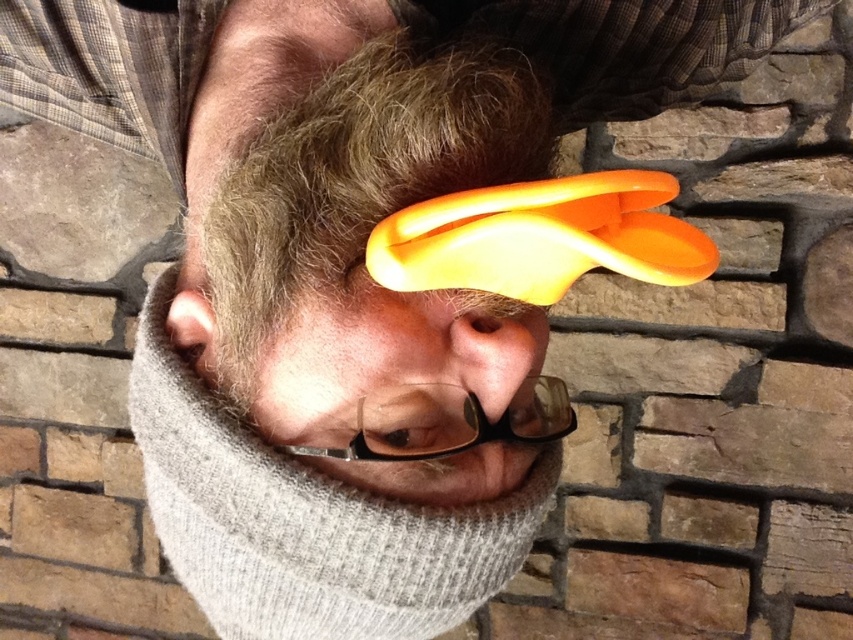
You are a photographer trying to capture a portrait of the person in the image. You need to ensure that both the brown fuzzy hair at center and the transparent plastic glasses at center are clearly visible. Given their sizes, which object should you focus on to ensure both are in frame without cropping?

Since the brown fuzzy hair at center is wider than the transparent plastic glasses at center, you should focus on framing the shot to accommodate the larger width of the brown fuzzy hair at center. This will naturally include the transparent plastic glasses at center as well.

You are a photographer trying to capture a clear shot of the person in the image. You notice the transparent plastic glasses at center and the brown fuzzy hair at center. Which object is blocking the view of the other?

The transparent plastic glasses at center is behind brown fuzzy hair at center, so the brown fuzzy hair at center is blocking the view of the transparent plastic glasses at center.

You are a photographer taking a portrait of the person with the brown fuzzy hair at center and gray woolen beard at center. You want to ensure both features are clearly visible in the photo. Based on their positions, which one might naturally stand out more in the composition?

The brown fuzzy hair at center is in front of the gray woolen beard at center, so the brown fuzzy hair at center will naturally stand out more in the composition as it is positioned closer to the viewer.